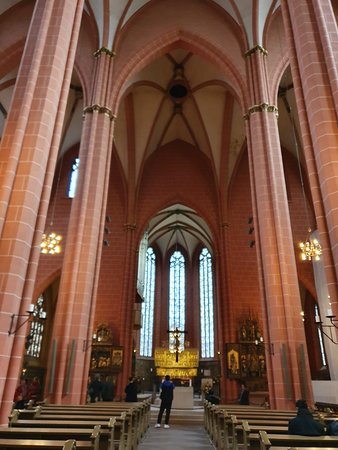
At what (x,y) coordinates should I click in order to perform the action: click on rows of brown wooden pews. Please return your answer as a coordinate pair (x, y). Looking at the image, I should click on (274, 442), (37, 445).